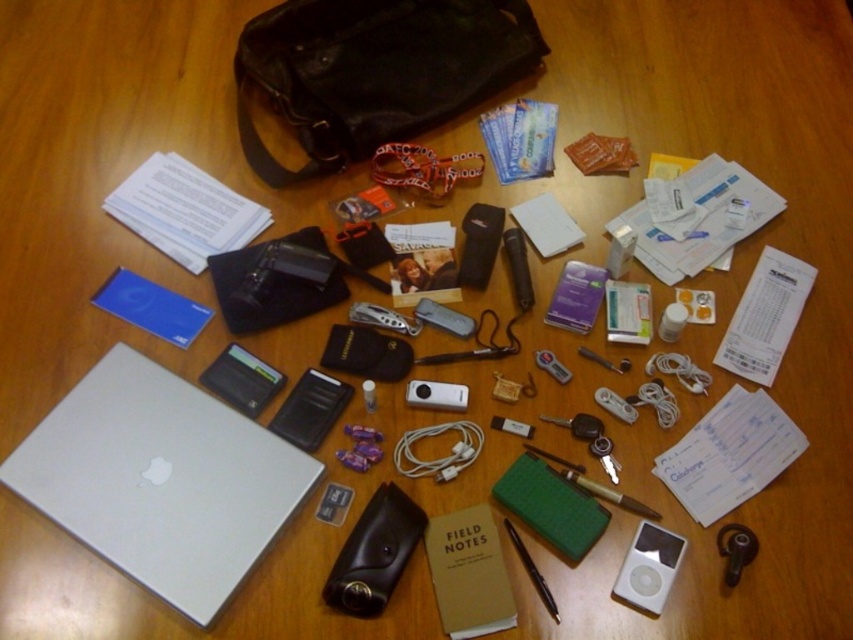
Question: Which point is closer to the camera?

Choices:
 (A) (544, 605)
 (B) (666, 557)
 (C) (258, 488)
 (D) (457, 385)

Answer: (A)

Question: Estimate the real-world distances between objects in this image. Which object is closer to the silver metallic laptop at lower left?

Choices:
 (A) black leather bag at upper center
 (B) white plastic ipod at center
 (C) black matte pen at center

Answer: (B)

Question: Can you confirm if white plastic ipod at center is smaller than black matte pen at center?

Choices:
 (A) yes
 (B) no

Answer: (A)

Question: Which of these objects is positioned closest to the black matte pen at center?

Choices:
 (A) white plastic ipod at center
 (B) black leather bag at upper center

Answer: (A)

Question: Does black leather bag at upper center appear on the right side of black matte pen at center?

Choices:
 (A) yes
 (B) no

Answer: (B)

Question: Is white plastic ipod at center thinner than black matte pen at center?

Choices:
 (A) no
 (B) yes

Answer: (A)